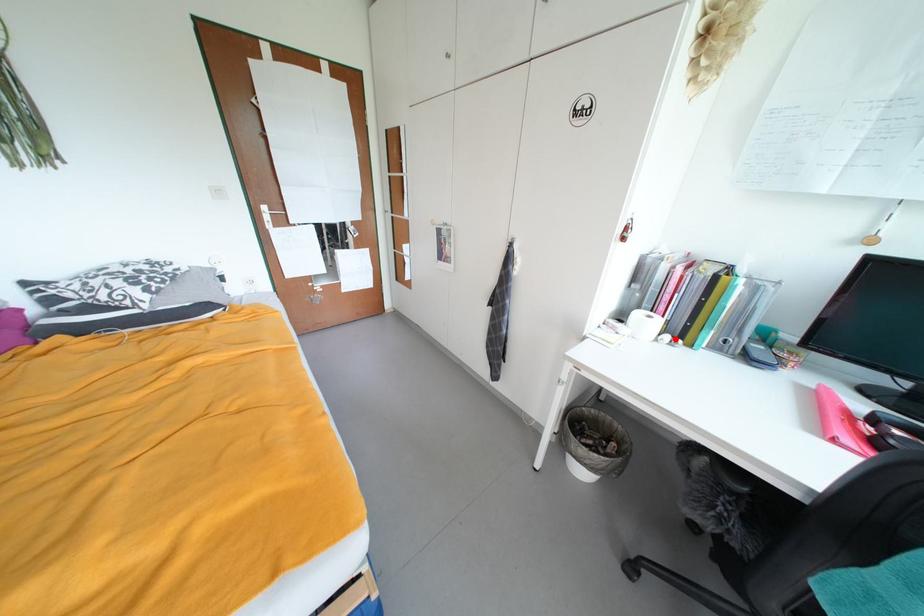
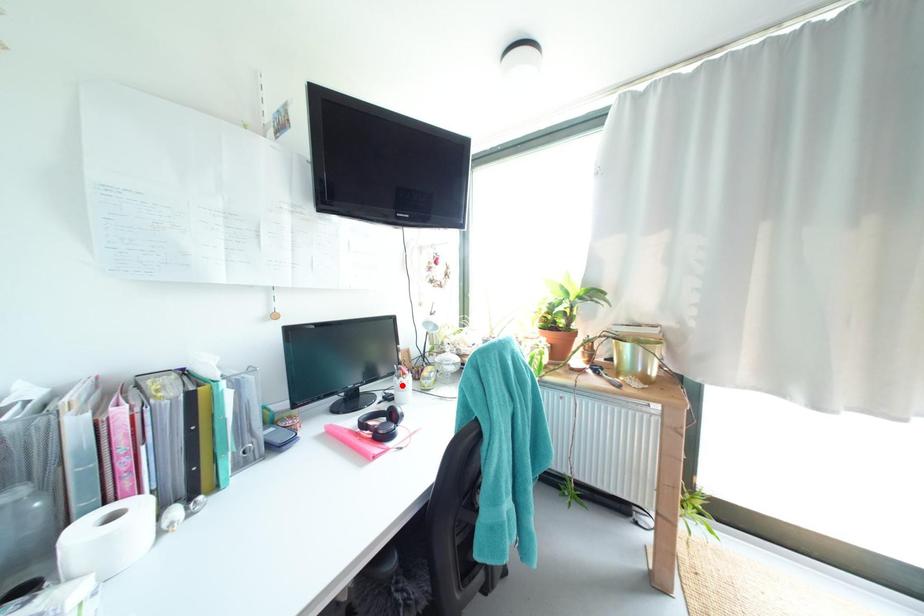
I am providing you with two images of the same scene from different viewpoints. A red point is marked on the first image and another point is marked on the second image. Does the point marked in image1 correspond to the same location as the one in image2?

No